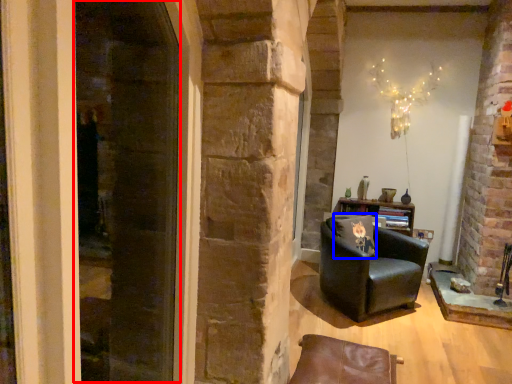
Question: Which of the following is the farthest to the observer, screen door (highlighted by a red box) or pillow (highlighted by a blue box)?

Choices:
 (A) screen door
 (B) pillow

Answer: (B)